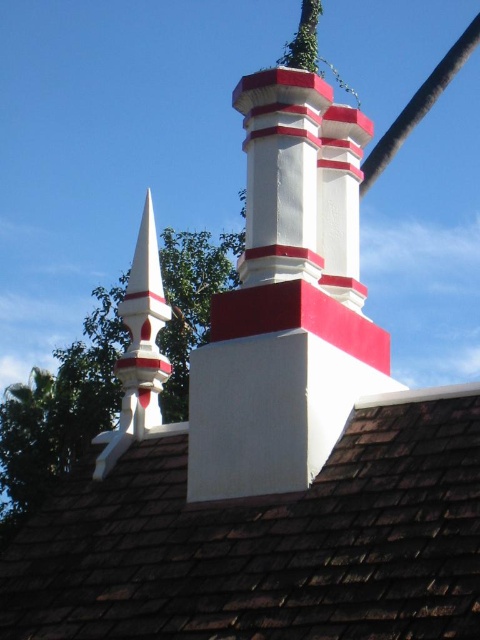
Question: Which object appears closest to the camera in this image?

Choices:
 (A) white painted brick chimney at upper center
 (B) black rubber pole at upper center
 (C) brown shingles at upper center

Answer: (C)

Question: Considering the real-world distances, which object is closest to the black rubber pole at upper center?

Choices:
 (A) brown shingles at upper center
 (B) white painted brick chimney at upper center

Answer: (A)

Question: Which object is closer to the camera taking this photo?

Choices:
 (A) brown shingles at upper center
 (B) white painted brick chimney at upper center

Answer: (A)

Question: Is brown shingles at upper center positioned before black rubber pole at upper center?

Choices:
 (A) yes
 (B) no

Answer: (A)

Question: Does brown shingles at upper center appear over black rubber pole at upper center?

Choices:
 (A) yes
 (B) no

Answer: (B)

Question: Is brown shingles at upper center thinner than black rubber pole at upper center?

Choices:
 (A) no
 (B) yes

Answer: (B)